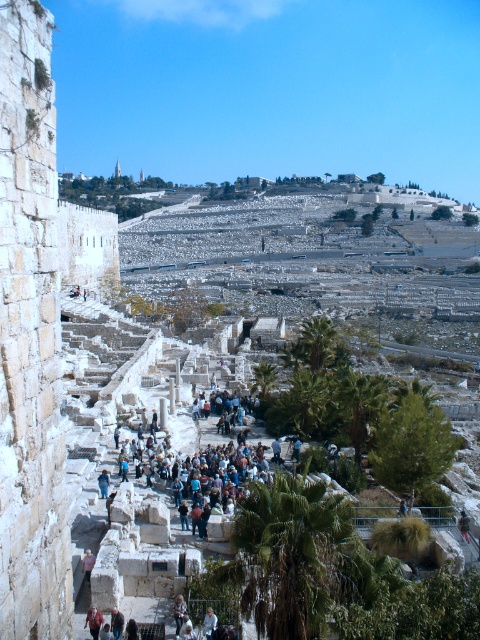
In the scene shown: You are a tourist standing at the entrance of the historical site. You see a green leafy palm tree at lower center and a light beige fabric at center. Which object is located to the right of the other?

The green leafy palm tree at lower center is positioned on the right side of light beige fabric at center, so the palm tree is to the right of the light beige fabric.

Based on the photo, you are an archaeologist standing in the historical site. You see a light brown leather jacket at center and a light beige fabric at center. Which item is located to the left of the other?

The light brown leather jacket at center is positioned on the left side of light beige fabric at center.

You are standing at the historical site and want to reach the point marked at coordinates (180, 616). Given that the path is uneven with steps and pathways, and you can walk at a pace of 1.5 meters per second, how long will it take you to reach the point?

The point marked at coordinates (180, 616) is 43.05 meters away from you. At a walking pace of 1.5 meters per second, it will take approximately 28.7 seconds to reach the point.